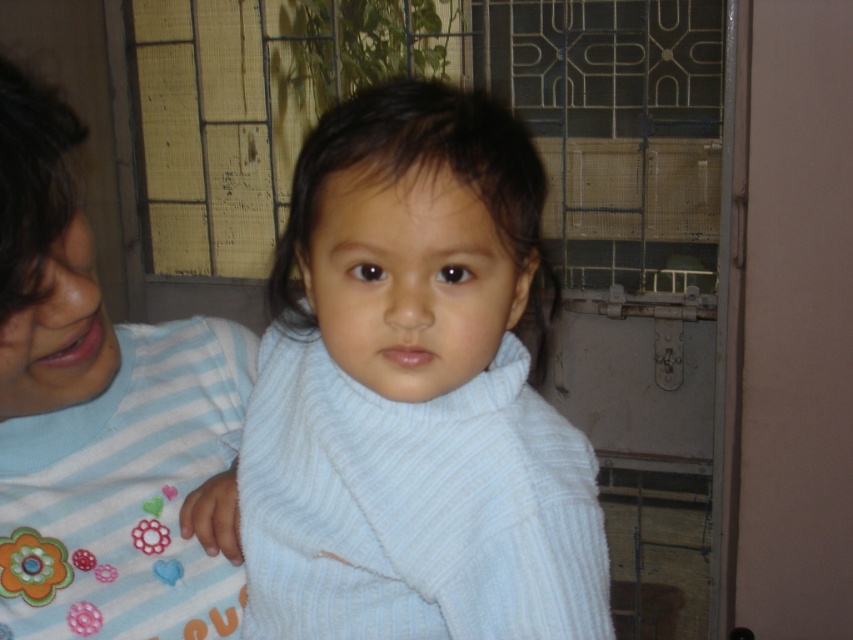
Is point (386, 241) behind point (238, 566)?

No, (386, 241) is in front of (238, 566).

Find the location of a particular element. Image resolution: width=853 pixels, height=640 pixels. light blue ribbed sweater at center is located at coordinates (413, 394).